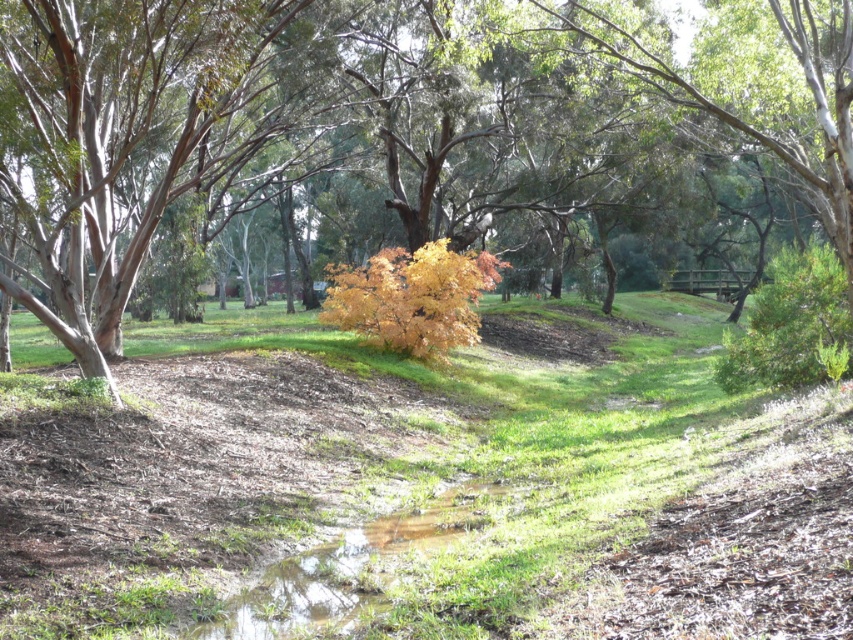
Question: Among these points, which one is farthest from the camera?

Choices:
 (A) (514, 260)
 (B) (314, 609)

Answer: (A)

Question: Is yellow leafy tree at center smaller than green grassy puddle at lower center?

Choices:
 (A) no
 (B) yes

Answer: (A)

Question: Is yellow leafy tree at center bigger than yellow autumn leaves at center?

Choices:
 (A) yes
 (B) no

Answer: (B)

Question: Among these points, which one is farthest from the camera?

Choices:
 (A) (1, 97)
 (B) (724, 580)
 (C) (404, 513)

Answer: (A)

Question: Which object is closer to the camera taking this photo?

Choices:
 (A) yellow autumn leaves at center
 (B) yellow leafy tree at center
 (C) green grassy puddle at lower center

Answer: (B)

Question: Does yellow leafy tree at center appear over green grassy puddle at lower center?

Choices:
 (A) yes
 (B) no

Answer: (A)